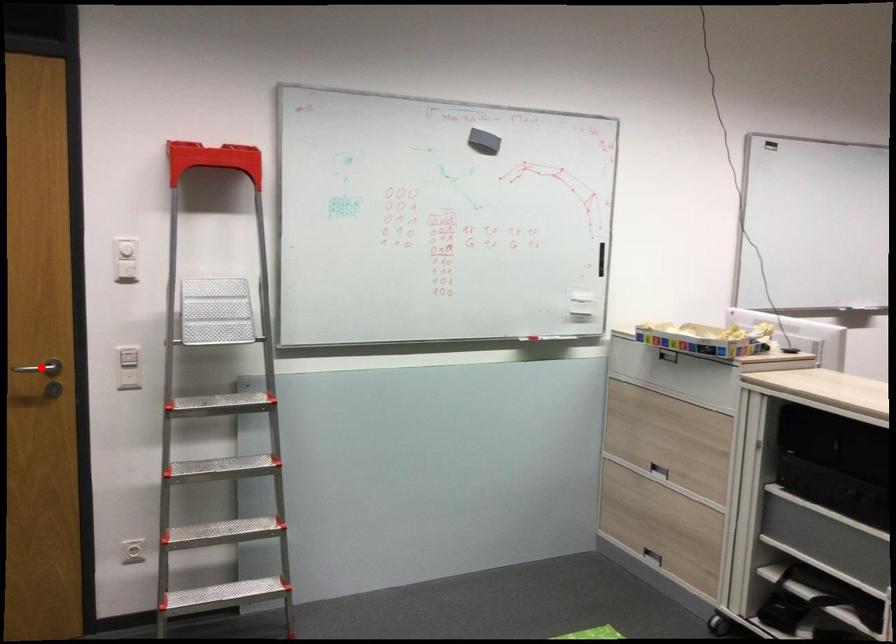
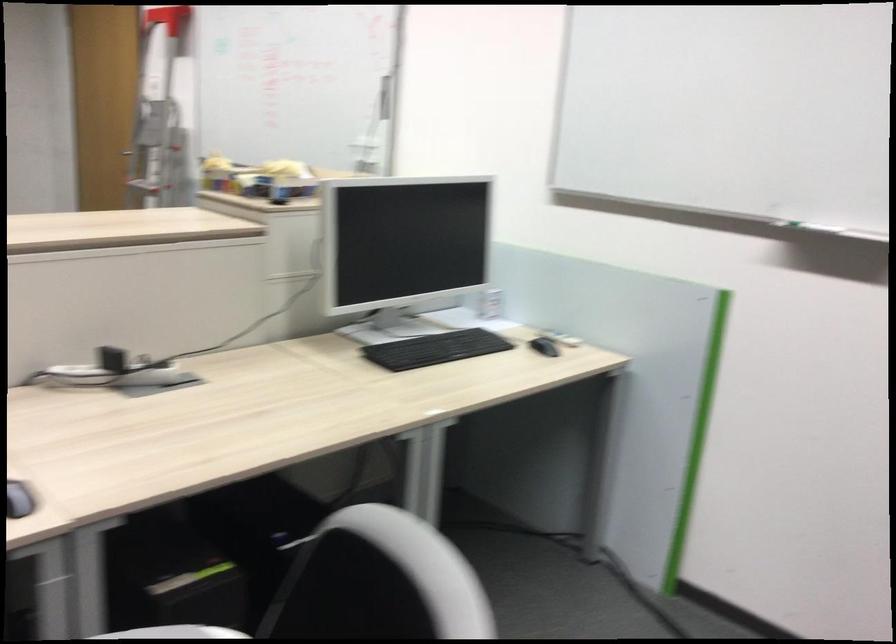
Question: I am providing you with two images of the same scene from different viewpoints. A red point is marked on the first image. At the location where the point appears in image 1, is it still visible in image 2?

Choices:
 (A) Yes
 (B) No

Answer: (B)